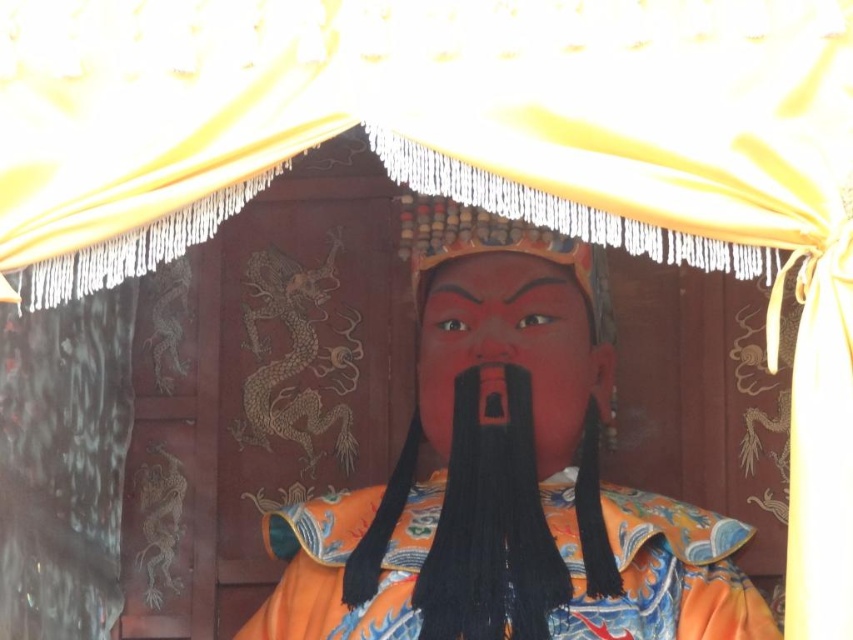
You are an assistant helping to prepare for a traditional Chinese ceremony. You see two orange robes at the center of the scene. Which one is closer to you, the matte orange robe at center or the orange satin robe at center?

The matte orange robe at center is closer to you because it is in front of the orange satin robe at center.

You are an artist trying to sketch the scene. The matte orange robe at center is positioned at coordinates 0.762 on the x axis and 0.596 on the y axis. If you want to draw the robe exactly where it is in the image, what coordinates should you use for its center?

The center of the matte orange robe at center should be drawn at coordinates x 0.762 and y 0.596.